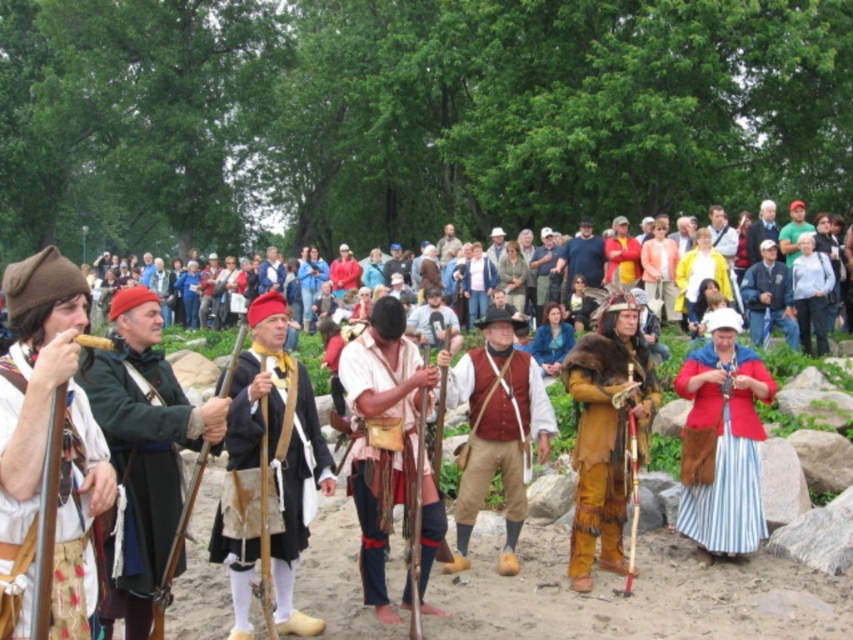
Question: Which point appears closest to the camera in this image?

Choices:
 (A) (280, 477)
 (B) (18, 577)

Answer: (B)

Question: Which point appears farthest from the camera in this image?

Choices:
 (A) coord(454,385)
 (B) coord(24,552)

Answer: (A)

Question: Is the position of white cotton shirt at center less distant than that of brown fur coat at center?

Choices:
 (A) yes
 (B) no

Answer: (A)

Question: Can you confirm if green woolen coat at left is smaller than brown fur coat at center?

Choices:
 (A) no
 (B) yes

Answer: (A)

Question: Among these points, which one is nearest to the camera?

Choices:
 (A) (397, 540)
 (B) (138, 557)
 (C) (704, 403)

Answer: (B)

Question: Considering the relative positions of blue denim jacket at center and light blue denim jacket at center in the image provided, where is blue denim jacket at center located with respect to light blue denim jacket at center?

Choices:
 (A) left
 (B) right

Answer: (A)